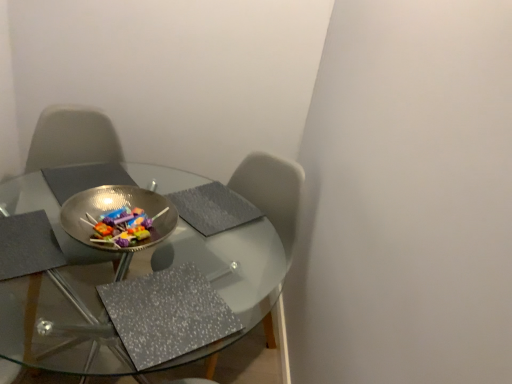
Question: Can you confirm if transparent glass table at center is wider than metallic reflective bowl at center?

Choices:
 (A) yes
 (B) no

Answer: (A)

Question: Is transparent glass table at center facing towards metallic reflective bowl at center?

Choices:
 (A) no
 (B) yes

Answer: (A)

Question: Does transparent glass table at center have a larger size compared to metallic reflective bowl at center?

Choices:
 (A) yes
 (B) no

Answer: (A)

Question: Is transparent glass table at center further to the viewer compared to metallic reflective bowl at center?

Choices:
 (A) yes
 (B) no

Answer: (B)

Question: From the image's perspective, is transparent glass table at center on metallic reflective bowl at center?

Choices:
 (A) no
 (B) yes

Answer: (A)

Question: From a real-world perspective, does transparent glass table at center stand above metallic reflective bowl at center?

Choices:
 (A) yes
 (B) no

Answer: (B)

Question: Does metallic reflective bowl at center turn towards transparent glass table at center?

Choices:
 (A) no
 (B) yes

Answer: (A)

Question: Is transparent glass table at center completely or partially inside metallic reflective bowl at center?

Choices:
 (A) no
 (B) yes

Answer: (A)

Question: Can you confirm if metallic reflective bowl at center is bigger than transparent glass table at center?

Choices:
 (A) no
 (B) yes

Answer: (A)

Question: Is the position of metallic reflective bowl at center less distant than that of transparent glass table at center?

Choices:
 (A) yes
 (B) no

Answer: (B)

Question: Is metallic reflective bowl at center at the left side of transparent glass table at center?

Choices:
 (A) no
 (B) yes

Answer: (A)

Question: Does metallic reflective bowl at center touch transparent glass table at center?

Choices:
 (A) no
 (B) yes

Answer: (A)

Question: Is point (64, 221) closer or farther from the camera than point (71, 276)?

Choices:
 (A) closer
 (B) farther

Answer: (A)